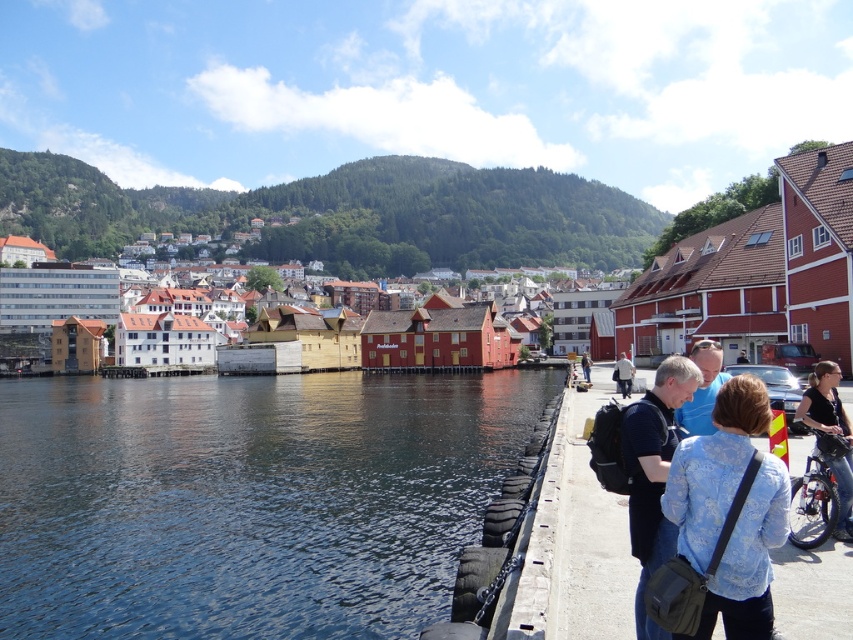
Does black fabric bicycle at lower right have a smaller size compared to matte black backpack at lower center?

No.

Does black fabric bicycle at lower right appear on the right side of matte black backpack at lower center?

Yes, black fabric bicycle at lower right is to the right of matte black backpack at lower center.

In the scene shown: Who is more distant from viewer, (827, 376) or (589, 381)?

The point (589, 381) is more distant.

Locate an element on the screen. This screenshot has width=853, height=640. black fabric bicycle at lower right is located at coordinates (831, 436).

You are a GUI agent. You are given a task and a screenshot of the screen. Output one action in this format:
    pyautogui.click(x=<x>, y=<y>)
    Task: Click on the white wooden buildings at center
    
    Given the screenshot: What is the action you would take?
    pyautogui.click(x=572, y=250)

Is white wooden buildings at center bigger than light blue denim jacket at lower right?

Yes.

The height and width of the screenshot is (640, 853). What do you see at coordinates (572, 250) in the screenshot?
I see `white wooden buildings at center` at bounding box center [572, 250].

The width and height of the screenshot is (853, 640). I want to click on white wooden buildings at center, so click(572, 250).

Can you confirm if blue fabric shirt at center is wider than light blue denim jacket at lower right?

Yes, blue fabric shirt at center is wider than light blue denim jacket at lower right.

Identify the location of blue fabric shirt at center. (701, 390).